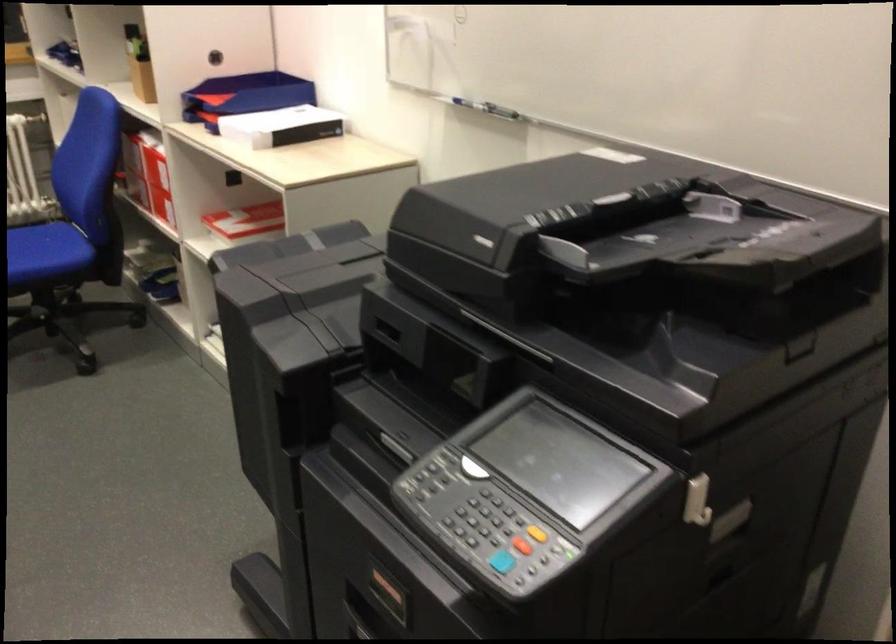
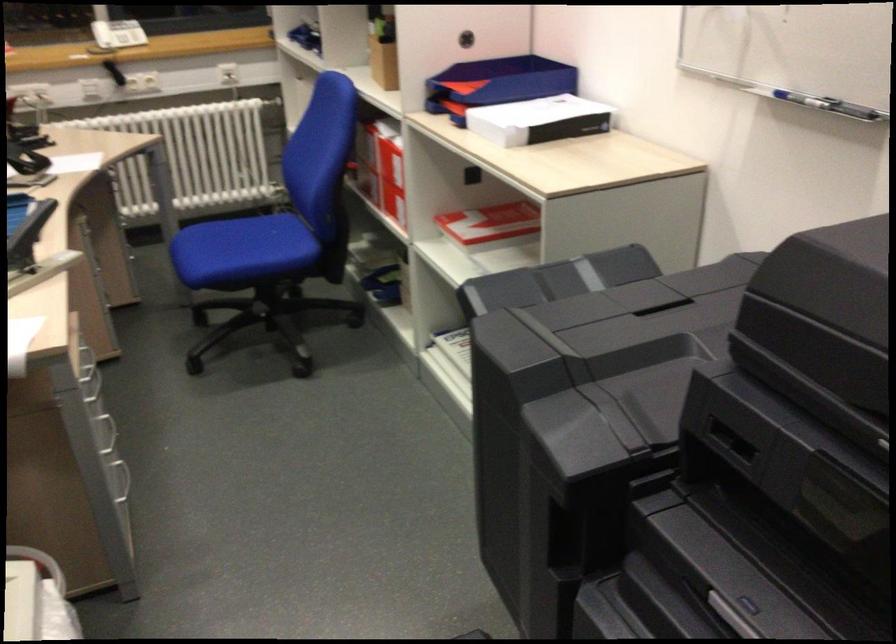
The point at (252,220) is marked in the first image. Where is the corresponding point in the second image?

(489, 223)